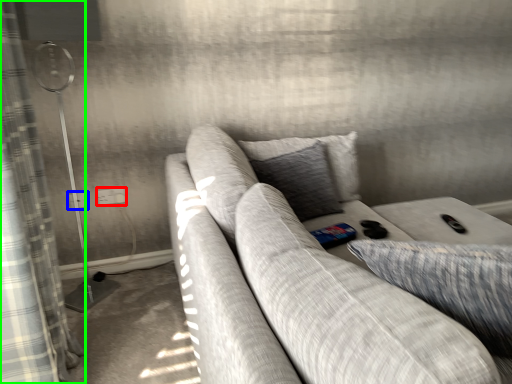
Question: Which object is the closest to the electric outlet (highlighted by a red box)? Choose among these: electric outlet (highlighted by a blue box) or curtain (highlighted by a green box).

Choices:
 (A) electric outlet
 (B) curtain

Answer: (A)